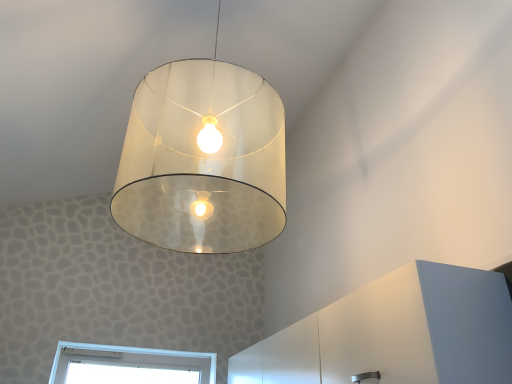
What do you see at coordinates (203, 159) in the screenshot?
I see `translucent glass lampshade at center` at bounding box center [203, 159].

What are the coordinates of `translucent glass lampshade at center` in the screenshot? It's located at coord(203,159).

What is the approximate width of translucent glass lampshade at center?

It is 23.41 inches.

Describe the element at coordinates (395, 333) in the screenshot. I see `white matte dresser at lower right` at that location.

I want to click on white matte dresser at lower right, so click(x=395, y=333).

You are a GUI agent. You are given a task and a screenshot of the screen. Output one action in this format:
    pyautogui.click(x=<x>, y=<y>)
    Task: Click on the translucent glass lampshade at center
    
    Given the screenshot: What is the action you would take?
    pyautogui.click(x=203, y=159)

Can you confirm if translucent glass lampshade at center is positioned to the left of white matte dresser at lower right?

Indeed, translucent glass lampshade at center is positioned on the left side of white matte dresser at lower right.

Does translucent glass lampshade at center come behind white matte dresser at lower right?

No, translucent glass lampshade at center is in front of white matte dresser at lower right.

Which is behind, point (206, 210) or point (494, 275)?

Point (206, 210)

From the image's perspective, who appears lower, translucent glass lampshade at center or white matte dresser at lower right?

white matte dresser at lower right is shown below in the image.

From a real-world perspective, who is located higher, translucent glass lampshade at center or white matte dresser at lower right?

From a 3D spatial view, translucent glass lampshade at center is above.

Does translucent glass lampshade at center have a greater width compared to white matte dresser at lower right?

Correct, the width of translucent glass lampshade at center exceeds that of white matte dresser at lower right.

From their relative heights in the image, would you say translucent glass lampshade at center is taller or shorter than white matte dresser at lower right?

Considering their sizes, translucent glass lampshade at center has more height than white matte dresser at lower right.

Which of these two, translucent glass lampshade at center or white matte dresser at lower right, is bigger?

translucent glass lampshade at center is bigger.

Could white matte dresser at lower right be considered to be inside translucent glass lampshade at center?

Definitely not — white matte dresser at lower right is not inside translucent glass lampshade at center.

Is translucent glass lampshade at center far from white matte dresser at lower right?

They are positioned close to each other.

Is translucent glass lampshade at center facing towards white matte dresser at lower right?

No, translucent glass lampshade at center is not turned towards white matte dresser at lower right.

Measure the distance between translucent glass lampshade at center and white matte dresser at lower right.

A distance of 28.43 inches exists between translucent glass lampshade at center and white matte dresser at lower right.

The height and width of the screenshot is (384, 512). Find the location of `dresser on the right of translucent glass lampshade at center`. dresser on the right of translucent glass lampshade at center is located at coordinates (395, 333).

Visually, is white matte dresser at lower right positioned to the left or to the right of translucent glass lampshade at center?

white matte dresser at lower right is positioned on translucent glass lampshade at center's right side.

Is white matte dresser at lower right further to camera compared to translucent glass lampshade at center?

Yes, white matte dresser at lower right is further from the viewer.

Does point (502, 340) lie behind point (234, 131)?

Yes, point (502, 340) is farther from viewer.

From the image's perspective, is white matte dresser at lower right on translucent glass lampshade at center?

No, from the image's perspective, white matte dresser at lower right is not above translucent glass lampshade at center.

From a real-world perspective, relative to translucent glass lampshade at center, is white matte dresser at lower right vertically above or below?

From a real-world perspective, white matte dresser at lower right is physically below translucent glass lampshade at center.

Can you confirm if white matte dresser at lower right is wider than translucent glass lampshade at center?

Incorrect, the width of white matte dresser at lower right does not surpass that of translucent glass lampshade at center.

Which of these two, white matte dresser at lower right or translucent glass lampshade at center, stands shorter?

With less height is white matte dresser at lower right.

Does white matte dresser at lower right have a smaller size compared to translucent glass lampshade at center?

Indeed, white matte dresser at lower right has a smaller size compared to translucent glass lampshade at center.

Do you think white matte dresser at lower right is within translucent glass lampshade at center, or outside of it?

white matte dresser at lower right is spatially situated outside translucent glass lampshade at center.

Are white matte dresser at lower right and translucent glass lampshade at center far apart?

No, white matte dresser at lower right is not far away from translucent glass lampshade at center.

Is white matte dresser at lower right oriented towards translucent glass lampshade at center?

No, white matte dresser at lower right is not facing towards translucent glass lampshade at center.

What's the angular difference between white matte dresser at lower right and translucent glass lampshade at center's facing directions?

There is a 90-degree angle between the facing directions of white matte dresser at lower right and translucent glass lampshade at center.

At what (x,y) coordinates should I click in order to perform the action: click on lamp on the left of white matte dresser at lower right. Please return your answer as a coordinate pair (x, y). This screenshot has width=512, height=384. Looking at the image, I should click on (203, 159).

Where is `lamp on the left of white matte dresser at lower right`? lamp on the left of white matte dresser at lower right is located at coordinates (203, 159).

The height and width of the screenshot is (384, 512). In order to click on lamp in front of the white matte dresser at lower right in this screenshot , I will do `click(203, 159)`.